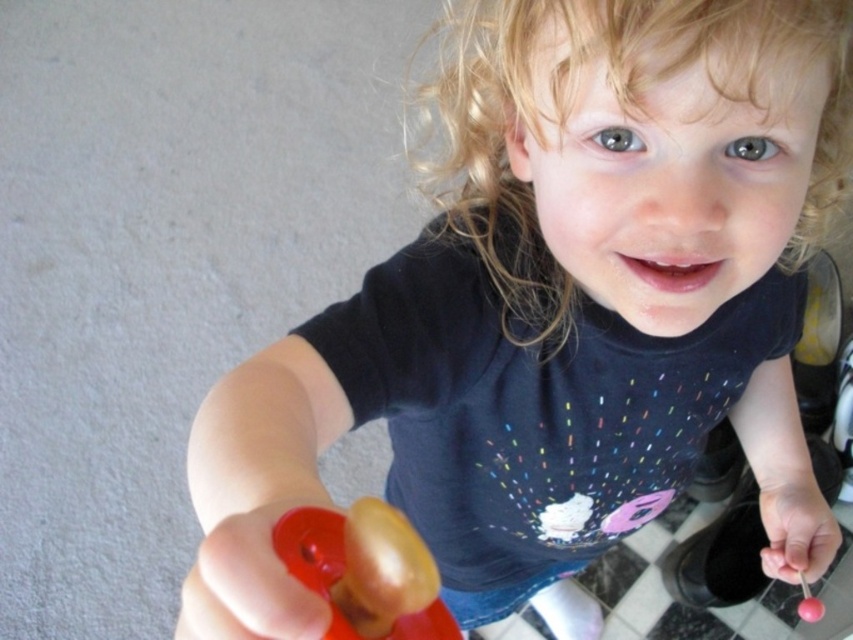
Question: Is rubberized plastic toy at lower center wider than pink rubber lollipop at lower right?

Choices:
 (A) no
 (B) yes

Answer: (A)

Question: Which point is closer to the camera?

Choices:
 (A) (334, 627)
 (B) (270, 579)

Answer: (B)

Question: Which of the following is the farthest from the observer?

Choices:
 (A) rubberized plastic toy at lower center
 (B) pink rubber lollipop at lower right
 (C) rubberized plastic toy at lower left

Answer: (B)

Question: Is rubberized plastic toy at lower center behind rubberized plastic toy at lower left?

Choices:
 (A) no
 (B) yes

Answer: (B)

Question: Which point appears farthest from the camera in this image?

Choices:
 (A) (805, 561)
 (B) (306, 540)
 (C) (264, 541)

Answer: (A)

Question: Is rubberized plastic toy at lower center smaller than rubberized plastic toy at lower left?

Choices:
 (A) no
 (B) yes

Answer: (A)